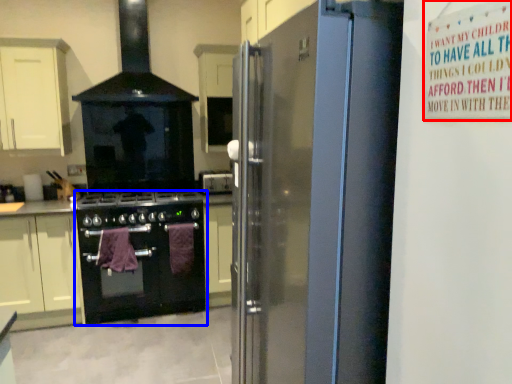
Question: Which of the following is the closest to the observer, warning sign (highlighted by a red box) or kitchen appliance (highlighted by a blue box)?

Choices:
 (A) warning sign
 (B) kitchen appliance

Answer: (A)